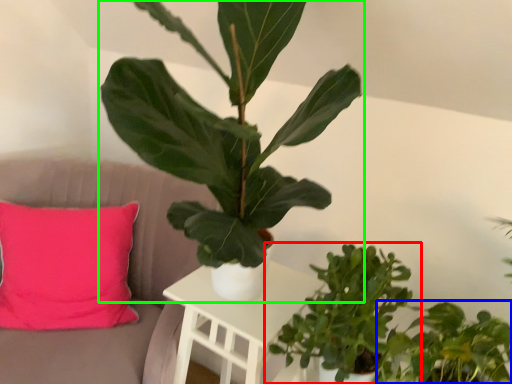
Question: Considering the real-world distances, which object is closest to houseplant (highlighted by a red box)? houseplant (highlighted by a blue box) or houseplant (highlighted by a green box).

Choices:
 (A) houseplant
 (B) houseplant

Answer: (A)